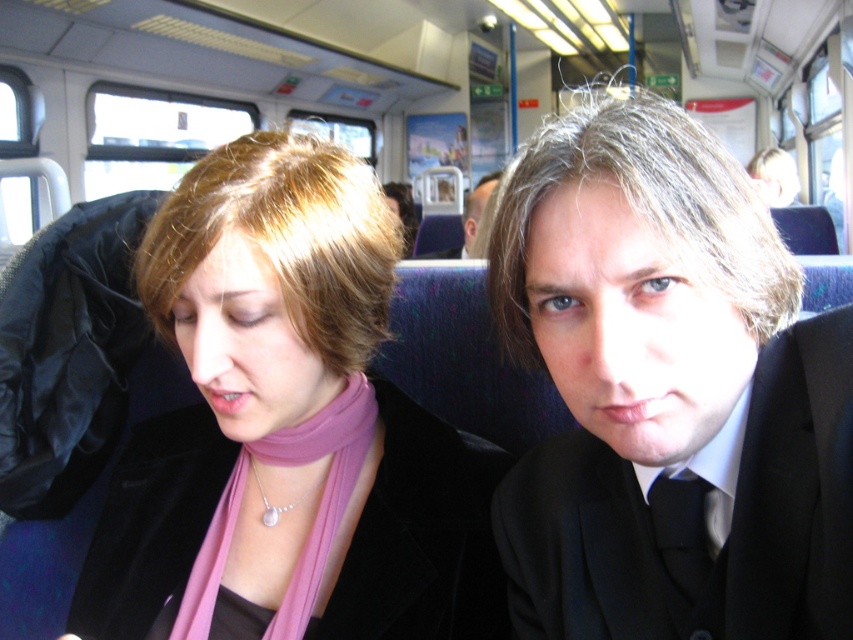
You are a photographer trying to capture a clear photo of both the matte black suit at center and the smooth black suit at center. Since you can only focus on one at a time, which one should you choose to ensure the other is still somewhat in focus?

The matte black suit at center is closer to the viewer than the smooth black suit at center. To ensure both are somewhat in focus, you should focus on the matte black suit at center because it is closer, and the smooth black suit at center will be slightly out of focus but still recognizable.

You are a photographer standing 1 meter away from the matte black suit at center and the pink fabric scarf at center. You want to take a photo of both objects in the same frame. Can you fit both objects into the camera frame if the camera has a maximum field of view of 1 meter width?

→ The distance between the matte black suit at center and the pink fabric scarf at center is 21.61 centimeters. Since the camera can capture a width of 1 meter, which is larger than the distance between them, both objects can fit into the frame.

You are a social distancing robot on a train. You need to check if two people are maintaining a safe distance of 20 inches. You see two people at point (560,378). Are they maintaining the required distance?

The two people at point (560,378) are 19.93 inches apart, which is less than the required 20 inches. They are not maintaining the safe distance.